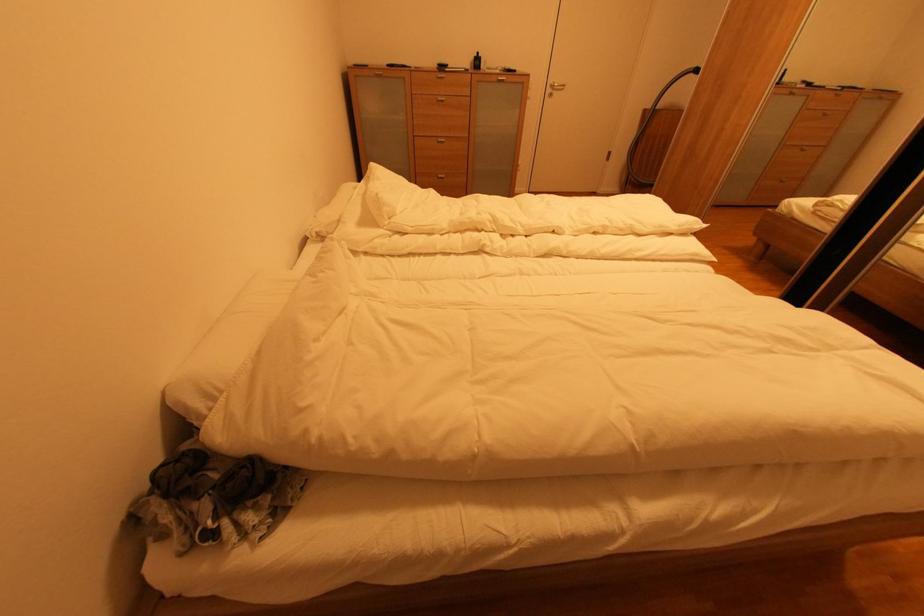
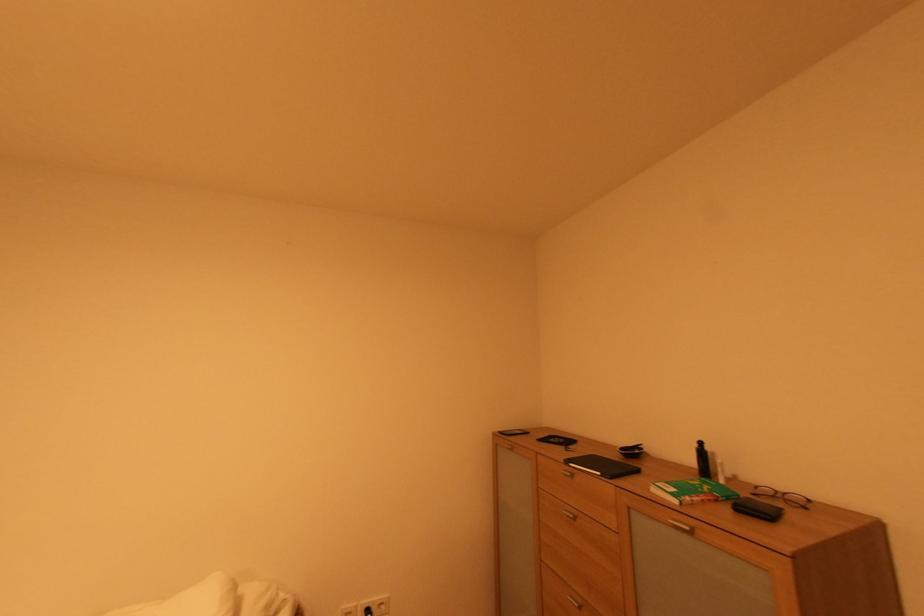
Locate, in the second image, the point that corresponds to pixel 481 55 in the first image.

(701, 447)